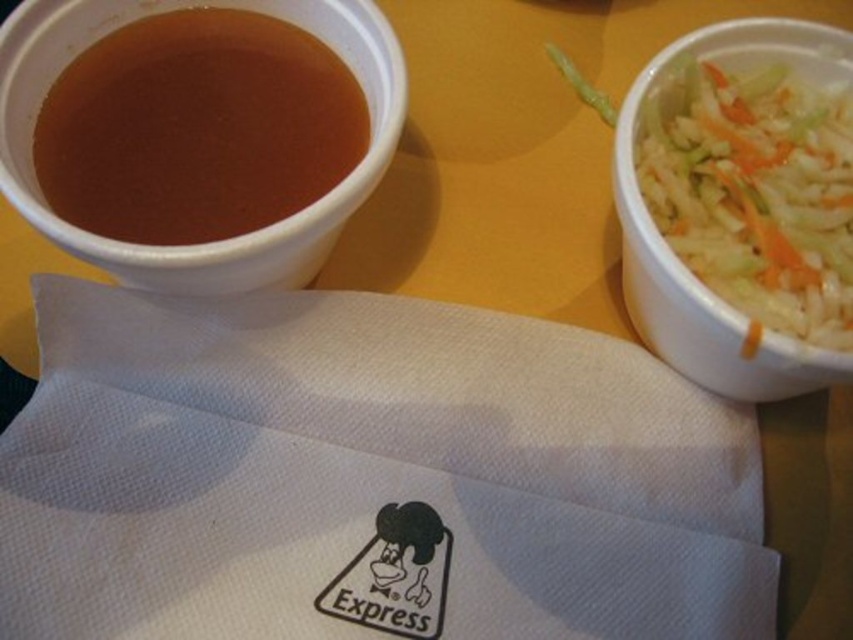
Consider the image. You are a customer at a fast food restaurant and you see the brown matte cup at upper left and the white shredded food at right on your table. Which item is closer to you?

The brown matte cup at upper left is closer to you because the white shredded food at right is behind it.

Based on the photo, you are taking a photo of the meal and want to focus on both point (x=268, y=145) and point (x=711, y=61). Which point should you adjust your focus to first to ensure it is in sharp detail?

Point (x=268, y=145) is closer to the camera than point (x=711, y=61), so you should focus on point (x=268, y=145) first to ensure it is in sharp detail before adjusting for the other point.